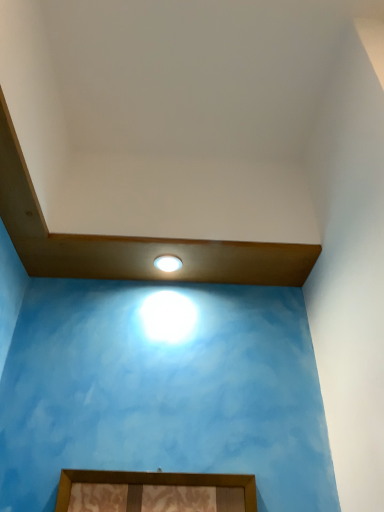
This screenshot has height=512, width=384. I want to click on white glossy droplight at upper center, so click(168, 263).

The width and height of the screenshot is (384, 512). What do you see at coordinates (168, 263) in the screenshot?
I see `white glossy droplight at upper center` at bounding box center [168, 263].

Locate an element on the screen. white glossy droplight at upper center is located at coordinates (168, 263).